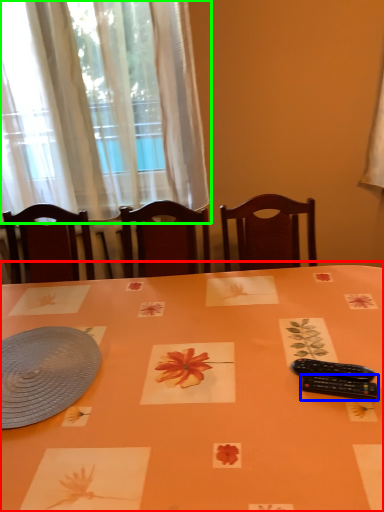
Question: Based on their relative distances, which object is nearer to table (highlighted by a red box)? Choose from control (highlighted by a blue box) and curtain (highlighted by a green box).

Choices:
 (A) control
 (B) curtain

Answer: (A)